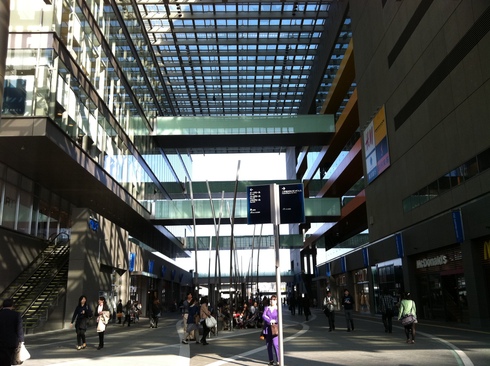
Image resolution: width=490 pixels, height=366 pixels. In order to click on advertisement on the wall in this screenshot , I will do `click(376, 139)`.